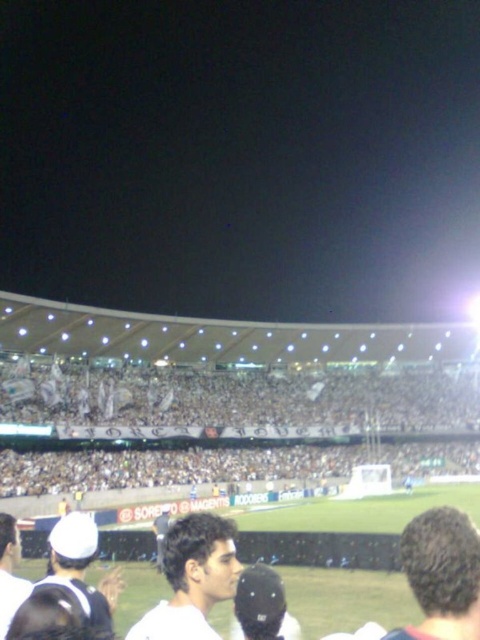
You are a photographer trying to capture the entire white fabric banner at center and the white matte cap at lower left in a single shot. Given that your camera lens has a maximum width capacity of 2 meters, can you fit both objects in the frame without cropping?

The white fabric banner at center is wider than the white matte cap at lower left. Since the banner is wider, and the camera lens can capture up to 2 meters, it depends on the actual width of the banner. However, the description only states the banner is larger in width than the cap but doesn

You are a photographer positioned at the edge of the field. You want to take a photo of the white fabric banner at center and the dark brown hair at lower right. Which object should you adjust your camera to focus on first if you want to capture both in the same frame?

The white fabric banner at center is to the left of dark brown hair at lower right, so you should focus on the white fabric banner at center first as it is closer to the left side of the frame.